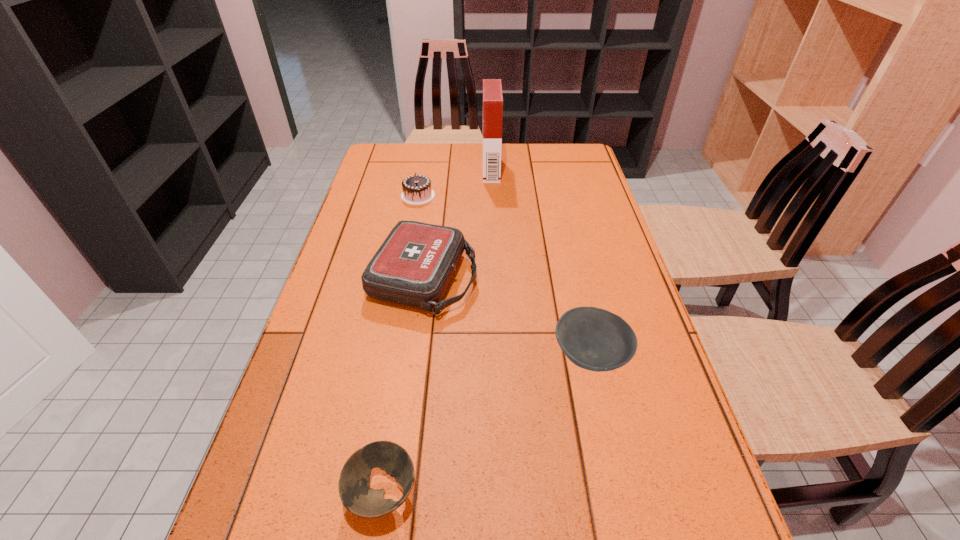
At what (x,y) coordinates should I click in order to perform the action: click on vacant space located on the front-facing side of the fourth object from left to right. Please return your answer as a coordinate pair (x, y). Looking at the image, I should click on point(435,170).

This screenshot has height=540, width=960. What are the coordinates of `vacant position located on the right of the third nearest object` in the screenshot? It's located at (620, 278).

I want to click on free space located on the back of the chocolate cake, so click(424, 160).

The width and height of the screenshot is (960, 540). I want to click on vacant space positioned on the front of the fourth farthest object, so click(604, 416).

The height and width of the screenshot is (540, 960). Find the location of `vacant position located on the right of the nearer bowl`. vacant position located on the right of the nearer bowl is located at coordinates (556, 492).

Locate an element on the screen. object that is positioned at the far edge is located at coordinates (492, 88).

You are a GUI agent. You are given a task and a screenshot of the screen. Output one action in this format:
    pyautogui.click(x=<x>, y=<y>)
    Task: Click on the first-aid kit that is positioned at the left edge
    This screenshot has height=540, width=960.
    Given the screenshot: What is the action you would take?
    pyautogui.click(x=414, y=265)

This screenshot has width=960, height=540. Identify the location of chocolate cake that is at the left edge. (417, 190).

Identify the location of object at the right edge. (594, 339).

I want to click on free space at the left edge, so click(x=267, y=508).